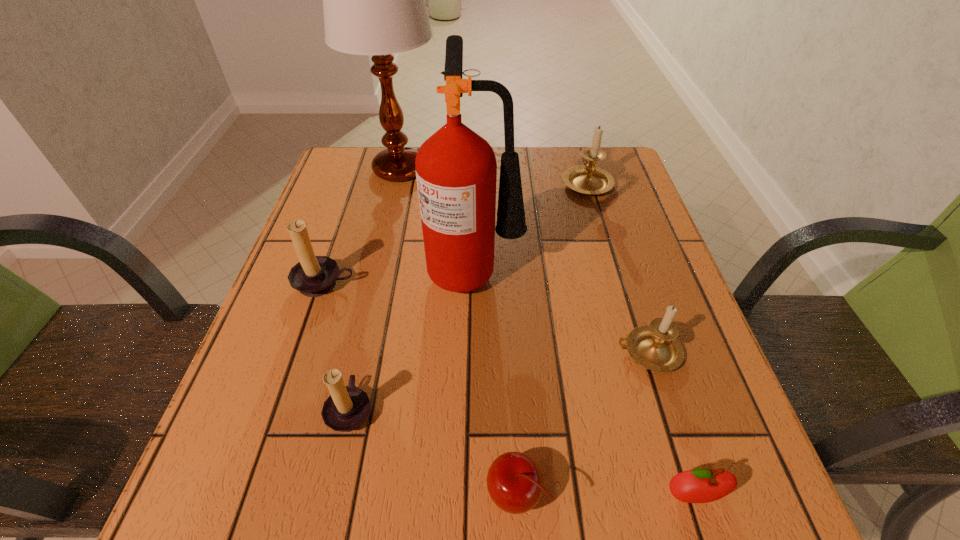
Where is `free space in the image that satisfies the following two spatial constraints: 1. on the back side of the cherry; 2. at the nozzle of the red fire extinguisher`? Image resolution: width=960 pixels, height=540 pixels. free space in the image that satisfies the following two spatial constraints: 1. on the back side of the cherry; 2. at the nozzle of the red fire extinguisher is located at coordinates (503, 268).

The width and height of the screenshot is (960, 540). Find the location of `vacant area in the image that satisfies the following two spatial constraints: 1. on the wick of the apple; 2. on the right side of the leftmost candle holder`. vacant area in the image that satisfies the following two spatial constraints: 1. on the wick of the apple; 2. on the right side of the leftmost candle holder is located at coordinates (253, 496).

This screenshot has height=540, width=960. I want to click on vacant space that satisfies the following two spatial constraints: 1. on the wick of the left brown candle holder; 2. on the right side of the apple, so click(x=253, y=496).